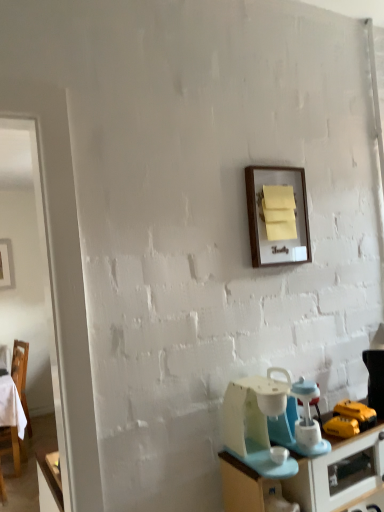
Question: In terms of size, does light blue plastic blender at lower right appear bigger or smaller than wooden frame at upper center?

Choices:
 (A) small
 (B) big

Answer: (B)

Question: From the image's perspective, is light blue plastic blender at lower right located above or below wooden frame at upper center?

Choices:
 (A) below
 (B) above

Answer: (A)

Question: Which of these objects is positioned closest to the wooden chair at left?

Choices:
 (A) wooden frame at upper center
 (B) matte blue desk at lower right
 (C) light blue plastic blender at lower right

Answer: (B)

Question: Considering the real-world distances, which object is farthest from the matte blue desk at lower right?

Choices:
 (A) wooden frame at upper center
 (B) wooden chair at left
 (C) light blue plastic blender at lower right

Answer: (B)